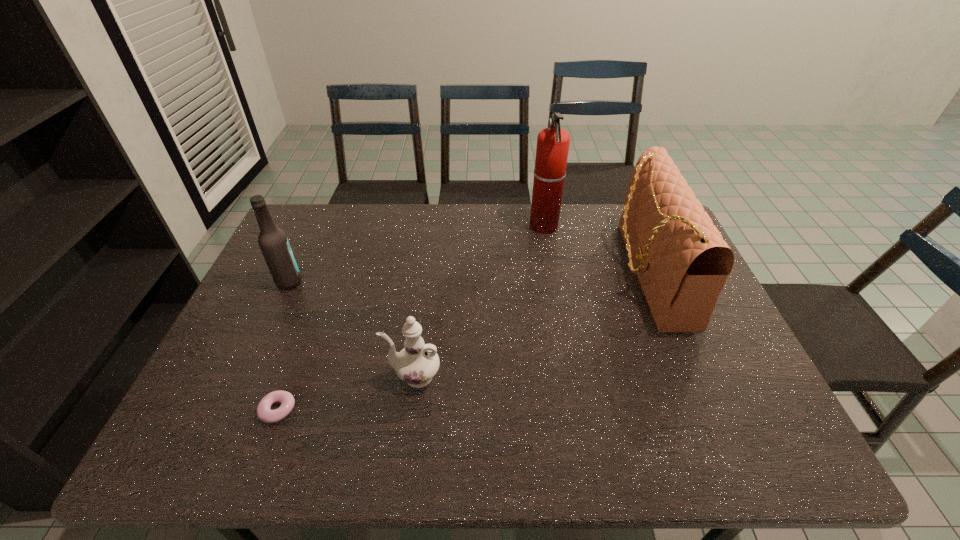
The image size is (960, 540). What are the coordinates of `handbag that is at the far edge` in the screenshot? It's located at (682, 262).

In order to click on object that is at the near edge in this screenshot , I will do `click(264, 413)`.

At what (x,y) coordinates should I click in order to perform the action: click on object that is at the left edge. Please return your answer as a coordinate pair (x, y). Looking at the image, I should click on (273, 242).

The height and width of the screenshot is (540, 960). I want to click on object that is at the right edge, so tap(682, 262).

Where is `object at the far right corner`? Image resolution: width=960 pixels, height=540 pixels. object at the far right corner is located at coordinates (682, 262).

Locate an element on the screen. The width and height of the screenshot is (960, 540). free spot at the far edge of the desktop is located at coordinates (363, 219).

Where is `vacant space at the near edge of the desktop`? The width and height of the screenshot is (960, 540). vacant space at the near edge of the desktop is located at coordinates (564, 444).

The width and height of the screenshot is (960, 540). Identify the location of vacant space at the right edge. (706, 393).

Image resolution: width=960 pixels, height=540 pixels. I want to click on free space at the far left corner of the desktop, so coord(302,204).

Locate an element on the screen. Image resolution: width=960 pixels, height=540 pixels. vacant space at the near left corner of the desktop is located at coordinates (240, 448).